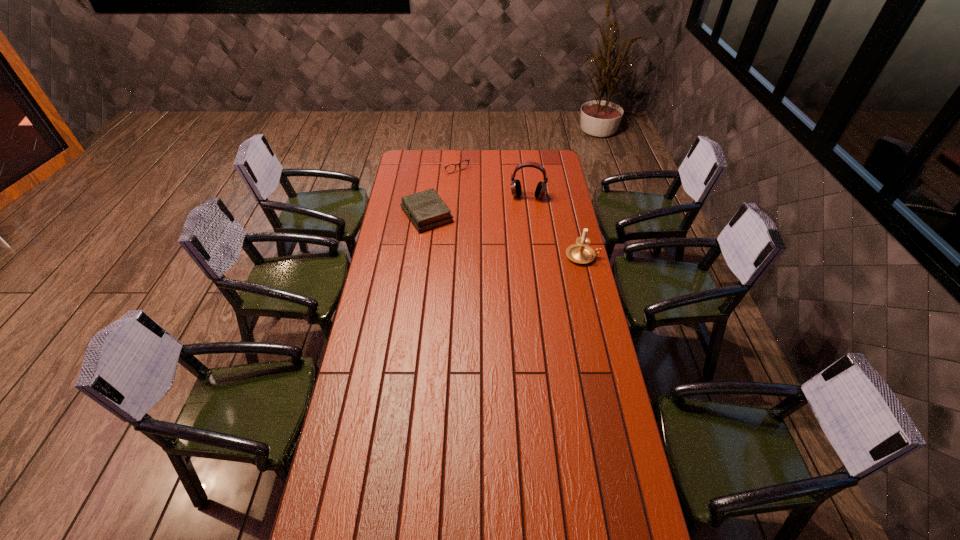
The height and width of the screenshot is (540, 960). What are the coordinates of `vacant position in the image that satisfies the following two spatial constraints: 1. on the front side of the candle holder; 2. with a handle on the side of the book` in the screenshot? It's located at (421, 256).

At what (x,y) coordinates should I click in order to perform the action: click on free space that satisfies the following two spatial constraints: 1. on the front side of the rightmost object; 2. with a handle on the side of the tallest object. Please return your answer as a coordinate pair (x, y). Looking at the image, I should click on (536, 256).